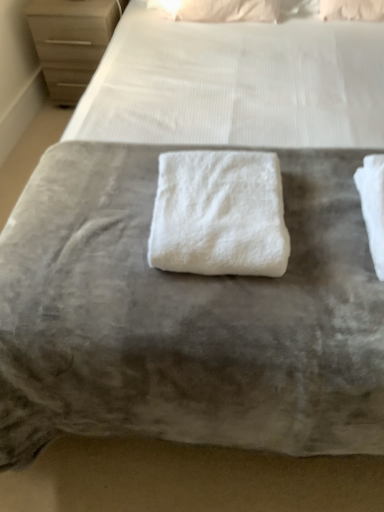
Question: Considering the relative sizes of white soft pillow at upper center and matte wood chest of drawers at upper left in the image provided, is white soft pillow at upper center thinner than matte wood chest of drawers at upper left?

Choices:
 (A) yes
 (B) no

Answer: (A)

Question: Can you confirm if white soft pillow at upper center is wider than matte wood chest of drawers at upper left?

Choices:
 (A) no
 (B) yes

Answer: (A)

Question: Is white soft pillow at upper center facing away from matte wood chest of drawers at upper left?

Choices:
 (A) no
 (B) yes

Answer: (A)

Question: Is white soft pillow at upper center at the right side of matte wood chest of drawers at upper left?

Choices:
 (A) no
 (B) yes

Answer: (B)

Question: Considering the relative sizes of white soft pillow at upper center and matte wood chest of drawers at upper left in the image provided, is white soft pillow at upper center bigger than matte wood chest of drawers at upper left?

Choices:
 (A) yes
 (B) no

Answer: (B)

Question: Is white soft pillow at upper center not within matte wood chest of drawers at upper left?

Choices:
 (A) yes
 (B) no

Answer: (A)

Question: Does white fluffy towel at center have a greater width compared to white soft pillow at upper center?

Choices:
 (A) no
 (B) yes

Answer: (B)

Question: Is white fluffy towel at center placed right next to white soft pillow at upper center?

Choices:
 (A) no
 (B) yes

Answer: (A)

Question: Does white fluffy towel at center have a lesser width compared to white soft pillow at upper center?

Choices:
 (A) no
 (B) yes

Answer: (A)

Question: From the image's perspective, is white fluffy towel at center below white soft pillow at upper center?

Choices:
 (A) no
 (B) yes

Answer: (B)

Question: Is white fluffy towel at center bigger than white soft pillow at upper center?

Choices:
 (A) no
 (B) yes

Answer: (B)

Question: Is white fluffy towel at center positioned with its back to white soft pillow at upper center?

Choices:
 (A) no
 (B) yes

Answer: (B)

Question: Can you confirm if matte wood chest of drawers at upper left is bigger than white fluffy towel at center?

Choices:
 (A) yes
 (B) no

Answer: (A)